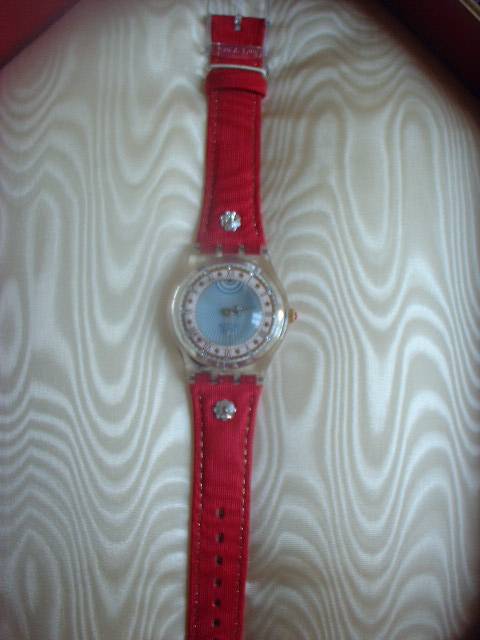
This screenshot has height=640, width=480. What are the coordinates of `box` in the screenshot? It's located at (474, 13).